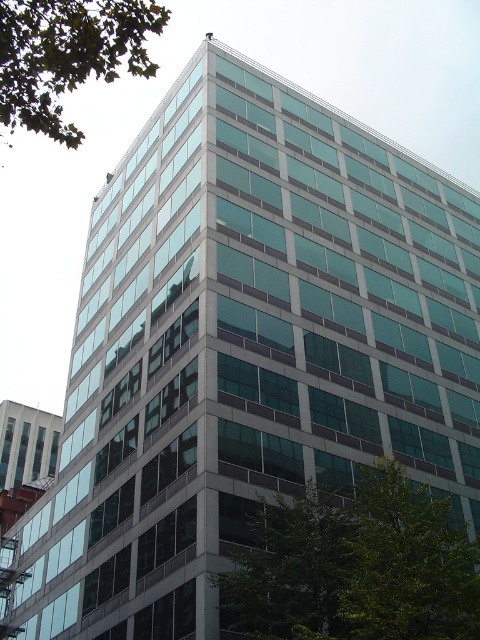
You are a drone operator tasked with flying a drone between the green leafy tree at lower right and the green leafy tree at upper left. The drone has a maximum flight distance of 20 meters. Based on the scene, can the drone safely complete this flight without exceeding its range?

The distance between the green leafy tree at lower right and the green leafy tree at upper left is 22.48 meters, which exceeds the drone operator has a maximum flight distance of 20 meters. Therefore, the drone cannot safely complete this flight without exceeding its range.